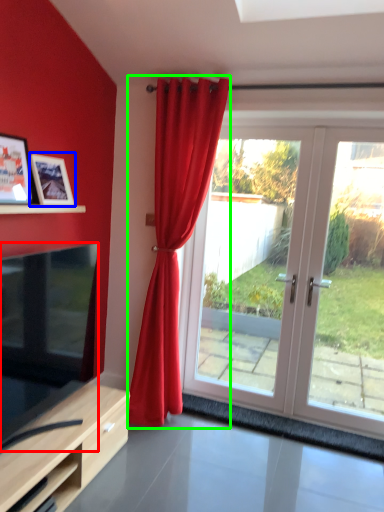
Question: Estimate the real-world distances between objects in this image. Which object is closer to television (highlighted by a red box), picture frame (highlighted by a blue box) or curtain (highlighted by a green box)?

Choices:
 (A) picture frame
 (B) curtain

Answer: (A)